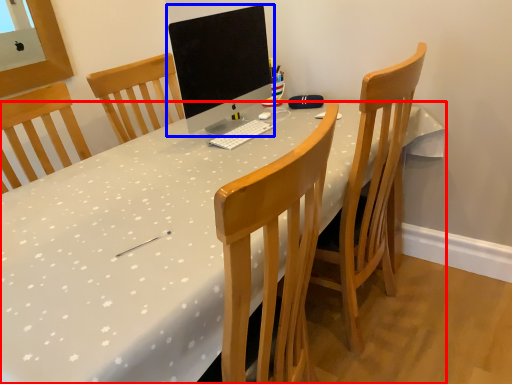
Question: Which of the following is the closest to the observer, desk (highlighted by a red box) or computer monitor (highlighted by a blue box)?

Choices:
 (A) desk
 (B) computer monitor

Answer: (A)